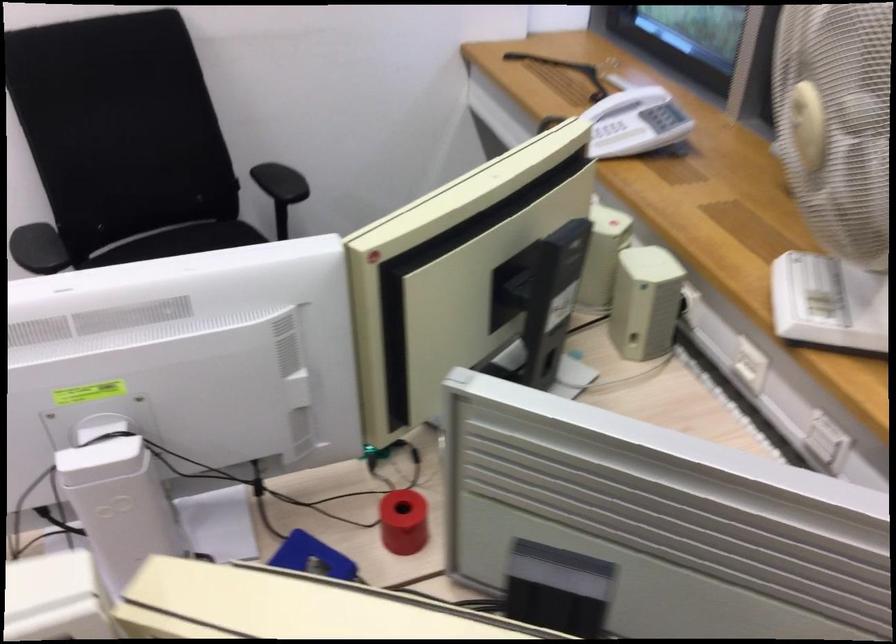
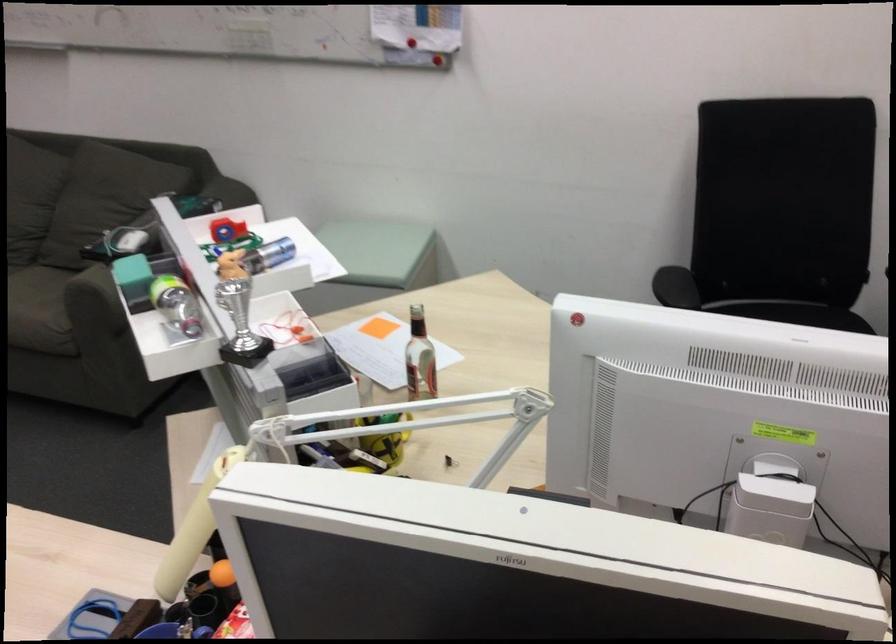
Question: How did the camera likely rotate?

Choices:
 (A) Left
 (B) Right
 (C) Up
 (D) Down

Answer: (A)